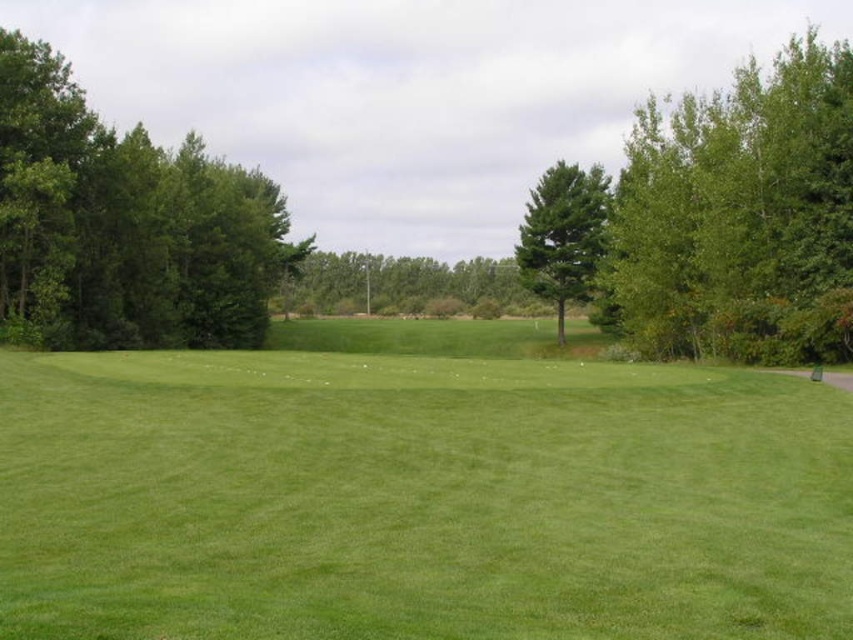
Is green leafy tree at left thinner than green leafy tree at center?

Correct, green leafy tree at left's width is less than green leafy tree at center's.

What do you see at coordinates (125, 225) in the screenshot?
I see `green leafy tree at left` at bounding box center [125, 225].

Where is `green leafy tree at left`? green leafy tree at left is located at coordinates (125, 225).

Does green grassy field at center appear on the left side of green textured tree at center?

Correct, you'll find green grassy field at center to the left of green textured tree at center.

The width and height of the screenshot is (853, 640). Describe the element at coordinates (418, 492) in the screenshot. I see `green grassy field at center` at that location.

Image resolution: width=853 pixels, height=640 pixels. Describe the element at coordinates (418, 492) in the screenshot. I see `green grassy field at center` at that location.

Locate an element on the screen. The height and width of the screenshot is (640, 853). green grassy field at center is located at coordinates (418, 492).

Is green leafy tree at upper right to the right of green leafy tree at center from the viewer's perspective?

Correct, you'll find green leafy tree at upper right to the right of green leafy tree at center.

Where is `green leafy tree at upper right`? green leafy tree at upper right is located at coordinates (740, 216).